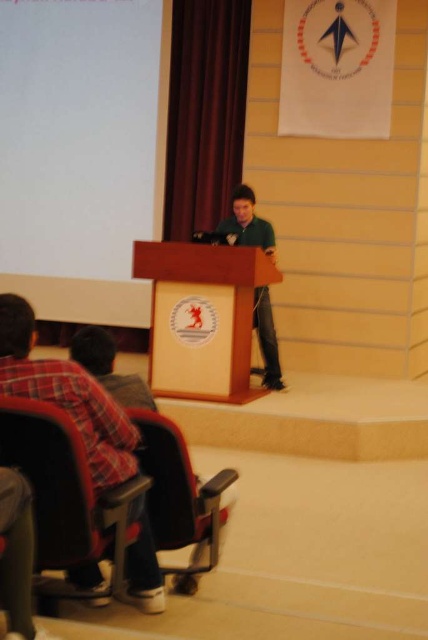
Which is below, wooden podium at center or plush fabric chair at lower left?

plush fabric chair at lower left is below.

Between point (226, 284) and point (65, 435), which one is positioned in front?

Point (65, 435)

The height and width of the screenshot is (640, 428). Find the location of `wooden podium at center`. wooden podium at center is located at coordinates (202, 317).

The image size is (428, 640). I want to click on wooden podium at center, so click(x=202, y=317).

Does wooden podium at center appear under green matte shirt at center?

Yes, wooden podium at center is below green matte shirt at center.

What are the coordinates of `wooden podium at center` in the screenshot? It's located at (202, 317).

Can you confirm if matte black chair at lower left is taller than green matte shirt at center?

Yes, matte black chair at lower left is taller than green matte shirt at center.

Which of these two, matte black chair at lower left or green matte shirt at center, stands taller?

With more height is matte black chair at lower left.

Image resolution: width=428 pixels, height=640 pixels. Describe the element at coordinates (180, 497) in the screenshot. I see `matte black chair at lower left` at that location.

Where is `matte black chair at lower left`? This screenshot has width=428, height=640. matte black chair at lower left is located at coordinates (180, 497).